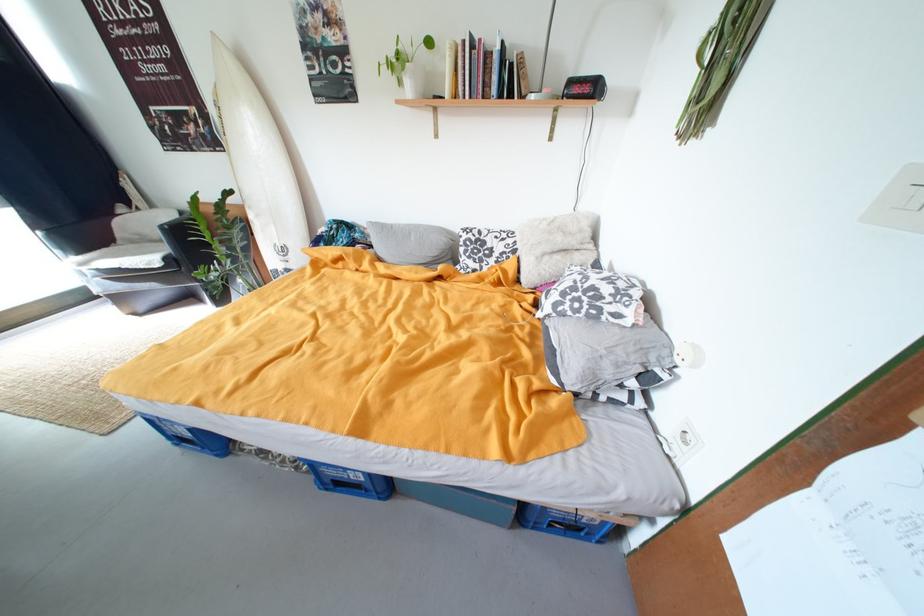
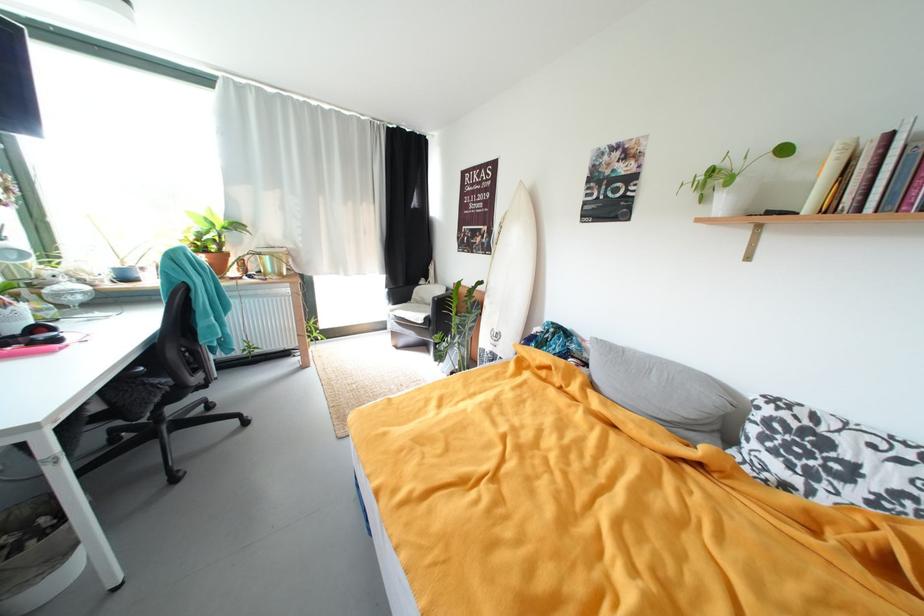
The point at (x=418, y=90) is marked in the first image. Where is the corresponding point in the second image?

(730, 206)